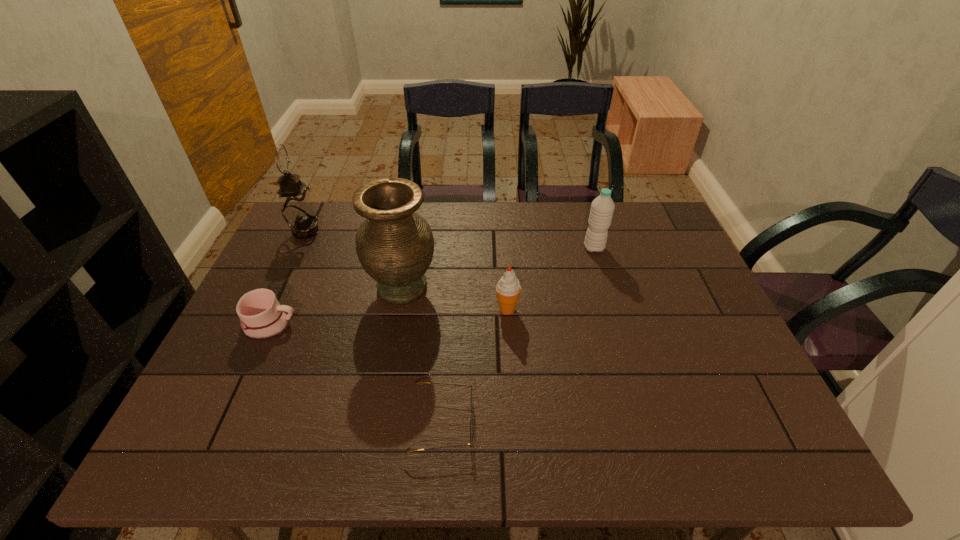
Find the location of a particular element. This screenshot has width=960, height=540. object present at the far left corner is located at coordinates (297, 208).

This screenshot has width=960, height=540. I want to click on vacant point at the far edge, so click(x=519, y=208).

In the image, there is a desktop. Identify the location of free space at the left edge. This screenshot has width=960, height=540. (210, 389).

The height and width of the screenshot is (540, 960). In the image, there is a desktop. In order to click on vacant space at the far left corner in this screenshot , I will do `click(329, 239)`.

Identify the location of vacant space at the far right corner. (634, 205).

This screenshot has width=960, height=540. I want to click on free space between the spectacles and the vase, so click(422, 355).

I want to click on vacant point located between the icecream and the nearest object, so click(x=474, y=366).

Where is `vacant point located between the shortest object and the second shortest object`? The width and height of the screenshot is (960, 540). vacant point located between the shortest object and the second shortest object is located at coordinates (356, 373).

Find the location of a particular element. The width and height of the screenshot is (960, 540). free space that is in between the mug and the oil lamp is located at coordinates (288, 278).

Where is `vacant region between the vase and the shortest object`? Image resolution: width=960 pixels, height=540 pixels. vacant region between the vase and the shortest object is located at coordinates (422, 355).